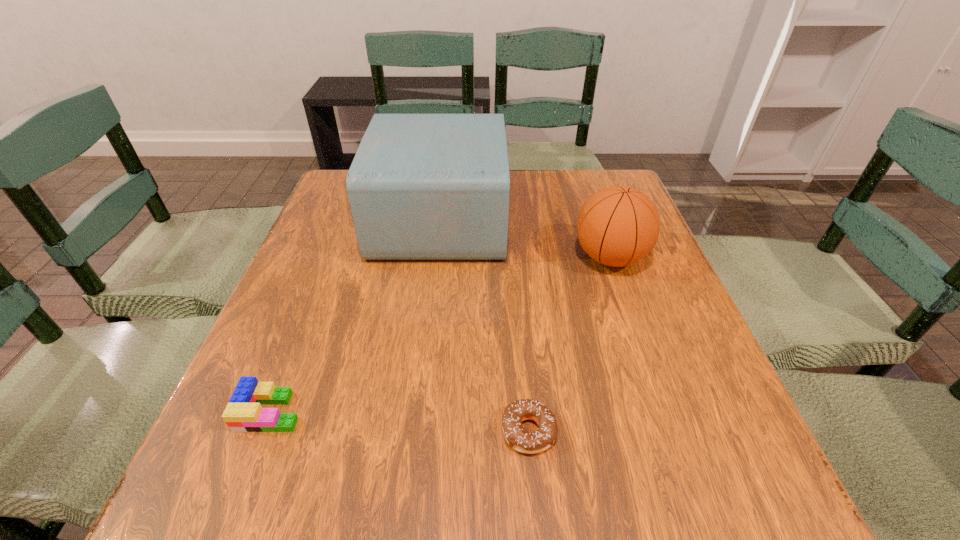
I want to click on vacant region between the Lego and the doughnut, so click(x=400, y=421).

Where is `free space between the second shortest object and the doughnut`? This screenshot has width=960, height=540. free space between the second shortest object and the doughnut is located at coordinates click(400, 421).

Locate an element on the screen. free space that is in between the doughnut and the radio receiver is located at coordinates (485, 325).

The width and height of the screenshot is (960, 540). I want to click on vacant space in between the second shortest object and the basketball, so click(x=441, y=334).

The image size is (960, 540). Identify the location of blank region between the leftmost object and the rightmost object. [441, 334].

Image resolution: width=960 pixels, height=540 pixels. Identify the location of vacant point located between the third tallest object and the doughnut. (400, 421).

Locate an element on the screen. The image size is (960, 540). free space between the Lego and the shortest object is located at coordinates (400, 421).

The image size is (960, 540). In order to click on empty space that is in between the basketball and the radio receiver in this screenshot , I will do `click(525, 238)`.

Locate an element on the screen. The width and height of the screenshot is (960, 540). free area in between the radio receiver and the second shortest object is located at coordinates (356, 315).

Where is `free space between the Lego and the basketball`? Image resolution: width=960 pixels, height=540 pixels. free space between the Lego and the basketball is located at coordinates (441, 334).